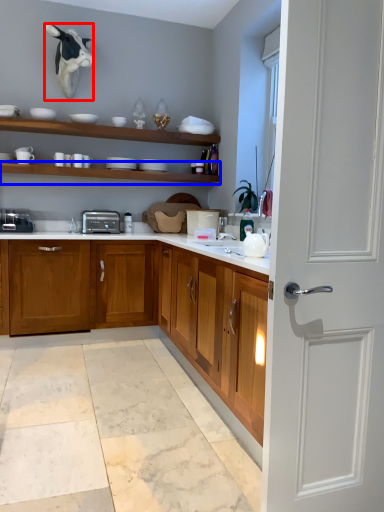
Question: Which object appears closest to the camera in this image, animal (highlighted by a red box) or shelf (highlighted by a blue box)?

Choices:
 (A) animal
 (B) shelf

Answer: (A)